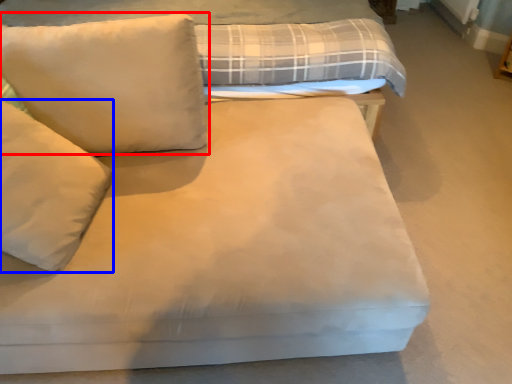
Question: Among these objects, which one is farthest to the camera, pillow (highlighted by a red box) or pillow (highlighted by a blue box)?

Choices:
 (A) pillow
 (B) pillow

Answer: (A)